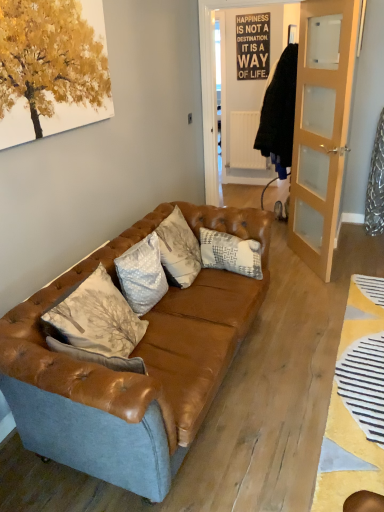
Question: Can you confirm if light brown wooden door at right is thinner than leather couch at center?

Choices:
 (A) no
 (B) yes

Answer: (B)

Question: From a real-world perspective, is light brown wooden door at right physically below leather couch at center?

Choices:
 (A) yes
 (B) no

Answer: (B)

Question: From a real-world perspective, is light brown wooden door at right on leather couch at center?

Choices:
 (A) no
 (B) yes

Answer: (B)

Question: Is light brown wooden door at right not inside leather couch at center?

Choices:
 (A) no
 (B) yes

Answer: (B)

Question: Is light brown wooden door at right looking in the opposite direction of leather couch at center?

Choices:
 (A) no
 (B) yes

Answer: (A)

Question: Is white textured pillow at center, which is the 2th pillow from back to front, taller or shorter than light brown wooden door at right?

Choices:
 (A) tall
 (B) short

Answer: (B)

Question: From the image's perspective, relative to light brown wooden door at right, is white textured pillow at center, which is the 2th pillow from back to front, above or below?

Choices:
 (A) below
 (B) above

Answer: (A)

Question: Is white textured pillow at center, which is the 2th pillow in right-to-left order, in front of or behind light brown wooden door at right in the image?

Choices:
 (A) behind
 (B) front

Answer: (B)

Question: Based on their sizes in the image, would you say white textured pillow at center, positioned as the first pillow in front-to-back order, is bigger or smaller than light brown wooden door at right?

Choices:
 (A) big
 (B) small

Answer: (B)

Question: Is light brown wooden door at right wider or thinner than white textured pillow at center, which ranks as the 1th pillow in left-to-right order?

Choices:
 (A) thin
 (B) wide

Answer: (A)

Question: Is light brown wooden door at right in front of or behind white textured pillow at center, positioned as the first pillow in front-to-back order, in the image?

Choices:
 (A) front
 (B) behind

Answer: (B)

Question: In terms of size, does light brown wooden door at right appear bigger or smaller than white textured pillow at center, positioned as the first pillow in front-to-back order?

Choices:
 (A) big
 (B) small

Answer: (A)

Question: In terms of height, does light brown wooden door at right look taller or shorter compared to white textured pillow at center, positioned as the first pillow in front-to-back order?

Choices:
 (A) short
 (B) tall

Answer: (B)

Question: From the image's perspective, is white textured pillow at center, the 2th pillow in the front-to-back sequence, positioned above or below white textured pillow at center, which is the 2th pillow in right-to-left order?

Choices:
 (A) above
 (B) below

Answer: (A)

Question: In the image, is white textured pillow at center, placed as the second pillow when sorted from left to right, on the left side or the right side of white textured pillow at center, positioned as the first pillow in front-to-back order?

Choices:
 (A) right
 (B) left

Answer: (A)